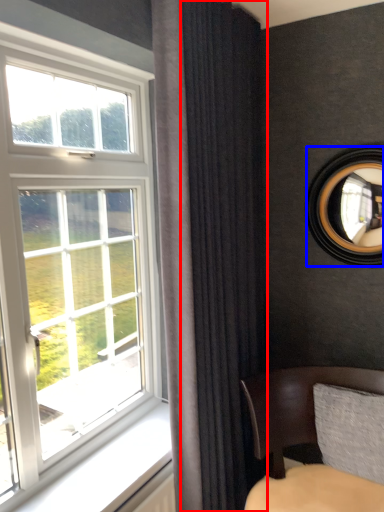
Question: Which point is further to the camera, curtain (highlighted by a red box) or mirror (highlighted by a blue box)?

Choices:
 (A) curtain
 (B) mirror

Answer: (B)